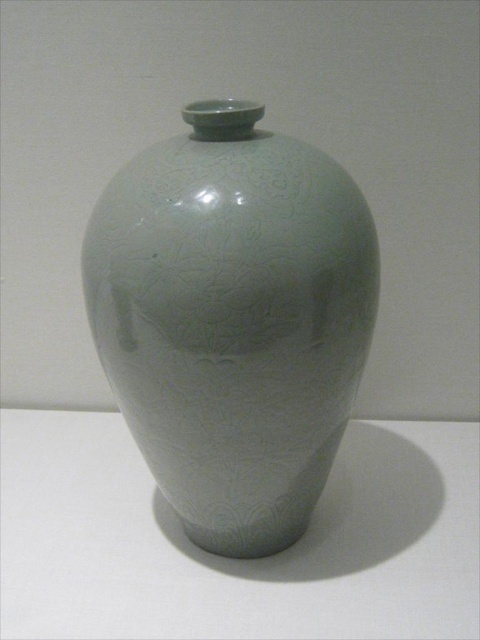
In the scene shown: You are standing in front of the ceramic vase in the museum. You want to take a photo of the point at coordinate (292, 416) on the vase. If your camera is 3.38 feet away from the point, is the camera close enough to capture a detailed photo of the floral patterns on the vase?

The point at coordinate (292, 416) on the vase is 3.38 feet away from the camera. Since the camera is positioned at this distance, it should be close enough to capture the detailed floral patterns on the vase, as the distance allows for clear focus and detail resolution.

You are an interior designer arranging a gallery space. You have a matte porcelain vase at center and a white glossy table at center. Which object would you need to adjust if you want the vase to visually dominate the composition?

Since the matte porcelain vase at center is smaller than the white glossy table at center, you would need to adjust the placement or scale of the white glossy table at center to make the vase visually dominate the composition.

You are an interior designer assessing the placement of the matte porcelain vase at center and the white glossy table at center in a gallery. Which object is taller?

The matte porcelain vase at center is taller than the white glossy table at center.